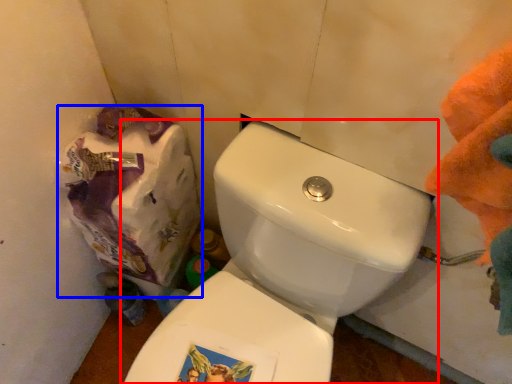
Question: Which of the following is the farthest to the observer, toilet (highlighted by a red box) or paper bag (highlighted by a blue box)?

Choices:
 (A) toilet
 (B) paper bag

Answer: (B)